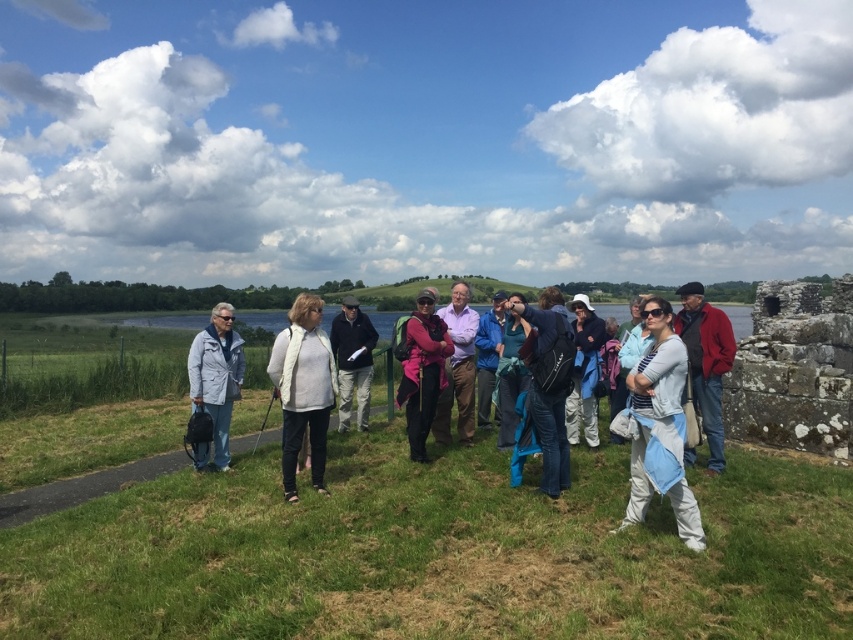
You are standing at point (436, 554) in the scene. What is the terrain like at that location?

The terrain at point (436, 554) is green grassy at center.

You are standing at the ancient stone structure on the right side of the frame. You see two points in the scene labeled as point (80, 595) and point (84, 449). Which point is closer to your current position?

Point (80, 595) is in front of point (84, 449), so it is closer to your current position at the ancient stone structure on the right side of the frame.